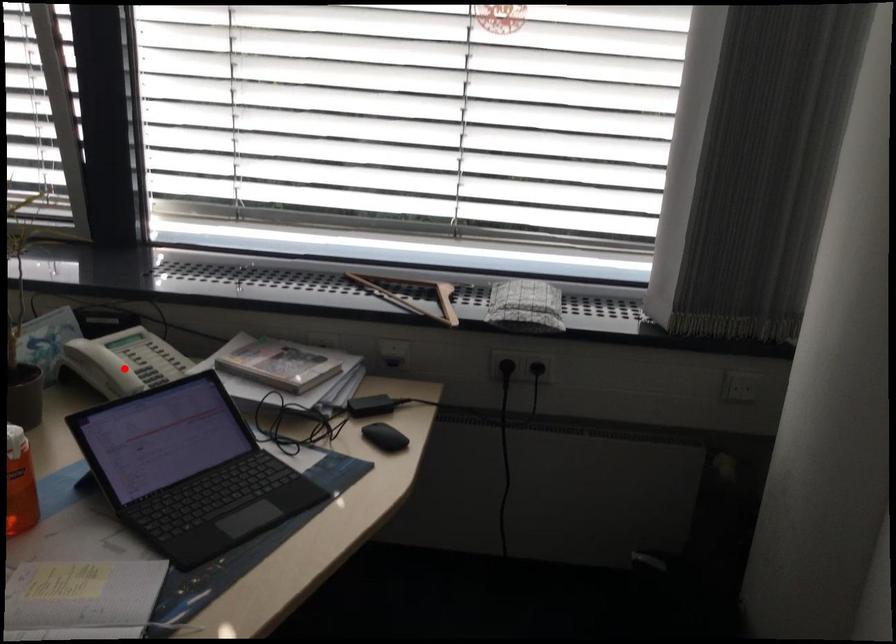
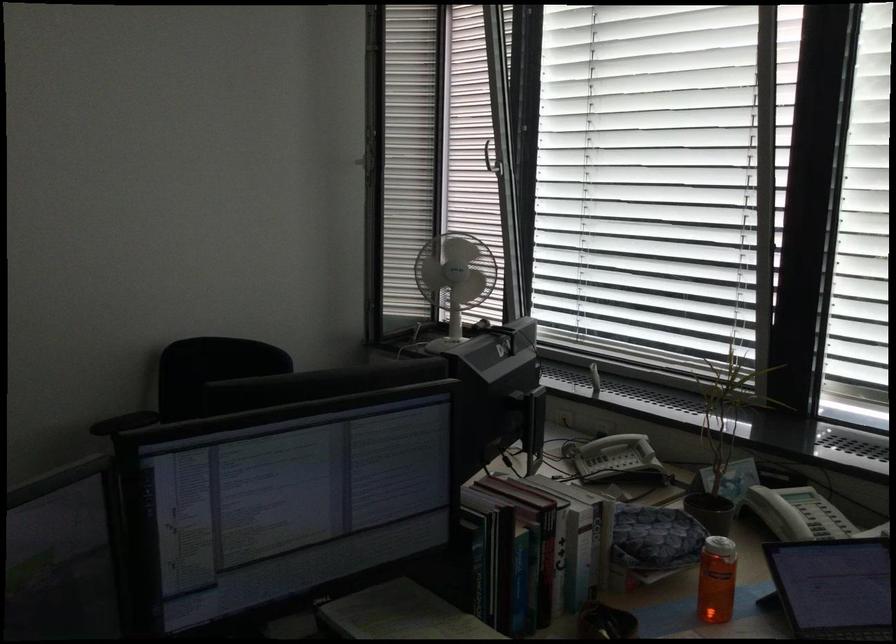
Question: I am providing you with two images of the same scene from different viewpoints. Image1 has a red point marked. In image2, the corresponding 3D location appears at what relative position? Reply with the corresponding letter.

Choices:
 (A) Closer
 (B) Farther

Answer: (B)